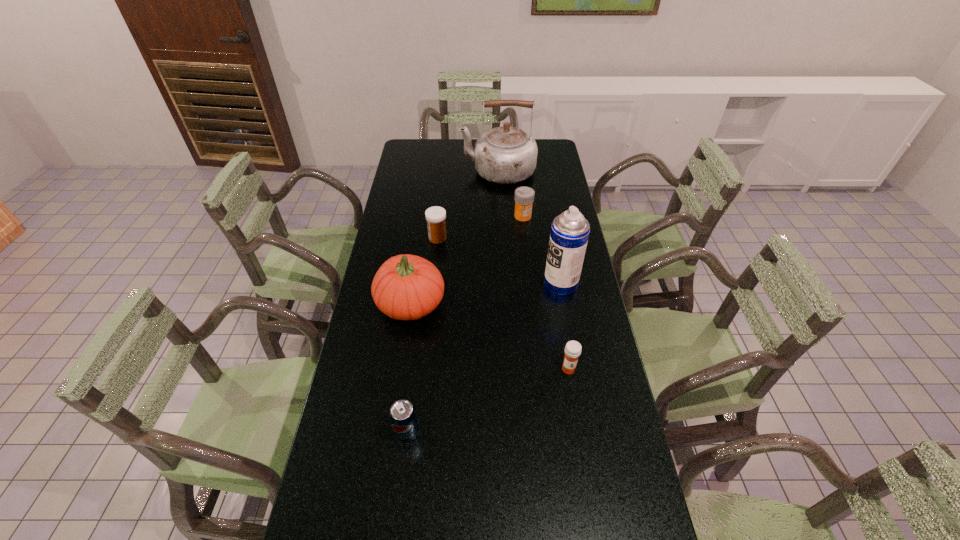
Locate an element on the screen. The height and width of the screenshot is (540, 960). vacant space situated on the label side of the nearest medicine is located at coordinates (x=575, y=408).

This screenshot has width=960, height=540. What are the coordinates of `object positioned at the far edge` in the screenshot? It's located at (505, 155).

Where is `pumpkin positioned at the left edge`? Image resolution: width=960 pixels, height=540 pixels. pumpkin positioned at the left edge is located at coordinates (406, 287).

This screenshot has width=960, height=540. I want to click on soda can located in the left edge section of the desktop, so click(403, 418).

Where is `kettle present at the right edge`? Image resolution: width=960 pixels, height=540 pixels. kettle present at the right edge is located at coordinates click(505, 155).

Locate an element on the screen. This screenshot has height=540, width=960. aerosol can that is at the right edge is located at coordinates (569, 235).

Image resolution: width=960 pixels, height=540 pixels. I want to click on object that is at the far right corner, so click(x=505, y=155).

In the image, there is a desktop. At what (x,y) coordinates should I click in order to perform the action: click on free space at the far edge. Please return your answer as a coordinate pair (x, y). The image size is (960, 540). Looking at the image, I should click on (454, 150).

In the image, there is a desktop. At what (x,y) coordinates should I click in order to perform the action: click on free region at the left edge. Please return your answer as a coordinate pair (x, y). Image resolution: width=960 pixels, height=540 pixels. Looking at the image, I should click on (401, 355).

This screenshot has height=540, width=960. Find the location of `free region at the right edge of the desktop`. free region at the right edge of the desktop is located at coordinates (593, 373).